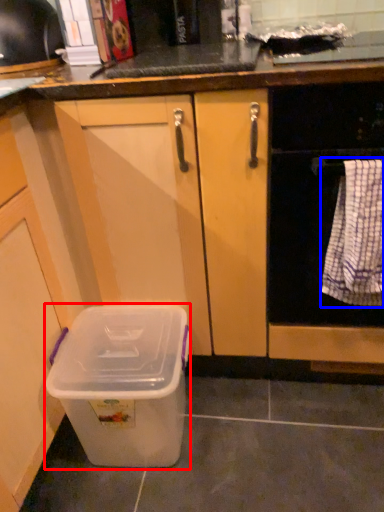
Question: Which object appears farthest to the camera in this image, storage box (highlighted by a red box) or blanket (highlighted by a blue box)?

Choices:
 (A) storage box
 (B) blanket

Answer: (A)